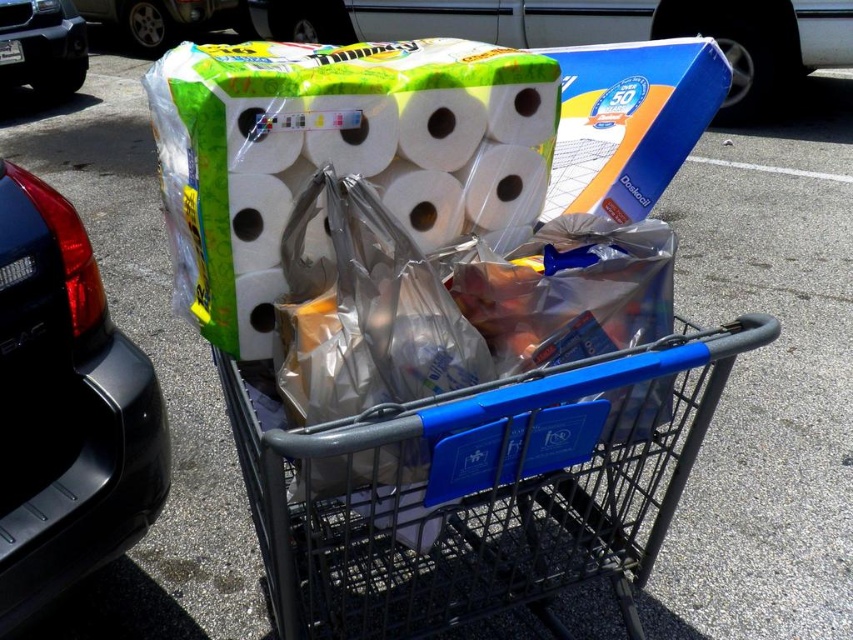
Question: Which object is the farthest from the white matte toilet paper at center?

Choices:
 (A) matte green paper towel at upper center
 (B) black plastic car at left

Answer: (A)

Question: Estimate the real-world distances between objects in this image. Which object is farther from the shiny silver car at upper left?

Choices:
 (A) matte green paper towel at upper center
 (B) black plastic car at left
 (C) metallic gray shopping cart at center

Answer: (C)

Question: Which object is positioned closest to the black plastic car at left?

Choices:
 (A) white matte toilet paper at center
 (B) black plastic car at upper left
 (C) matte green paper towel at upper center
 (D) metallic gray shopping cart at center

Answer: (A)

Question: Where is matte green paper towel at upper center located in relation to shiny silver car at upper left in the image?

Choices:
 (A) left
 (B) right

Answer: (B)

Question: Where is metallic gray shopping cart at center located in relation to white matte toilet paper at center in the image?

Choices:
 (A) below
 (B) above

Answer: (A)

Question: Can you confirm if metallic gray shopping cart at center is positioned to the right of black plastic car at upper left?

Choices:
 (A) no
 (B) yes

Answer: (B)